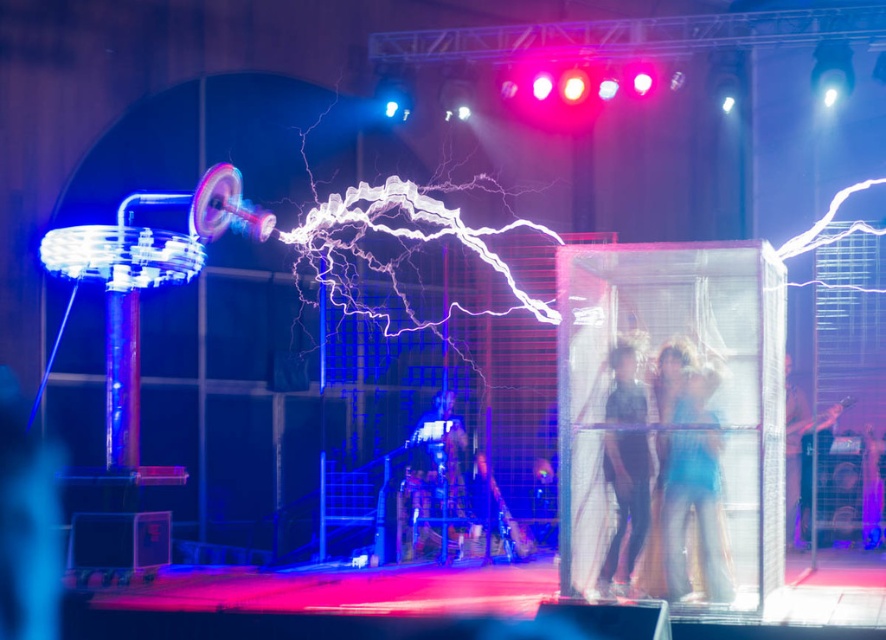
Does blue denim jeans at center appear on the right side of dark blue fabric at center?

Indeed, blue denim jeans at center is positioned on the right side of dark blue fabric at center.

Which of these two, blue denim jeans at center or dark blue fabric at center, stands shorter?

Standing shorter between the two is blue denim jeans at center.

Describe the element at coordinates (689, 472) in the screenshot. I see `blue denim jeans at center` at that location.

Locate an element on the screen. The image size is (886, 640). blue denim jeans at center is located at coordinates (689, 472).

Is dark blue fabric at center below light blue fabric at right?

No.

In the scene shown: Who is shorter, dark blue fabric at center or light blue fabric at right?

With less height is light blue fabric at right.

Who is more distant from viewer, [616,396] or [789,508]?

The point [789,508] is more distant.

Identify the location of dark blue fabric at center. This screenshot has height=640, width=886. (626, 465).

Is point (694, 440) behind point (811, 426)?

That is False.

Which is behind, point (663, 422) or point (789, 355)?

The point (789, 355) is behind.

Find the location of a particular element. blue denim jeans at center is located at coordinates (689, 472).